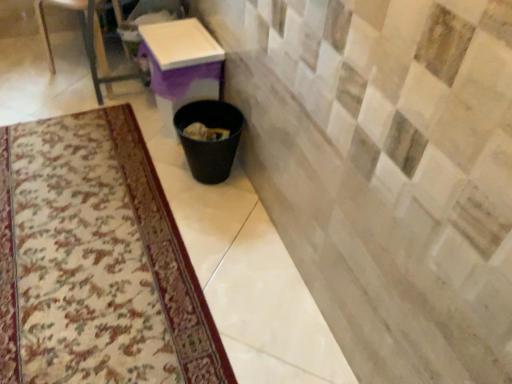
In order to click on free space between black plastic trash can at lower center and carpeted mat at lower left in this screenshot , I will do `click(210, 227)`.